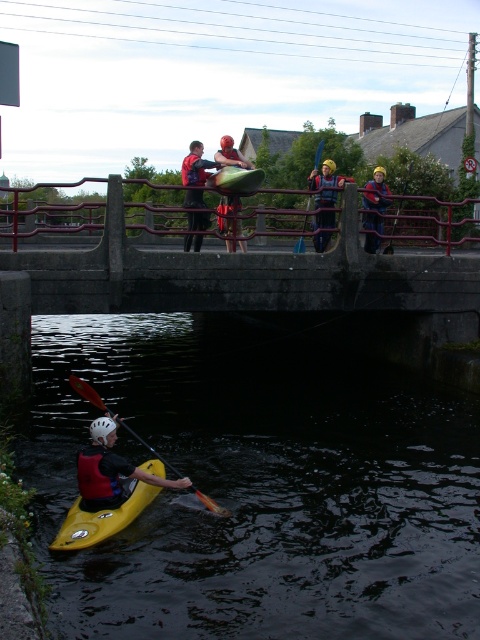
Is blue fabric life jacket at center shorter than matte green canoe at center?

No.

Is blue fabric life jacket at center to the right of matte green canoe at center from the viewer's perspective?

Yes, blue fabric life jacket at center is to the right of matte green canoe at center.

The width and height of the screenshot is (480, 640). What do you see at coordinates (324, 193) in the screenshot?
I see `blue fabric life jacket at center` at bounding box center [324, 193].

You are a GUI agent. You are given a task and a screenshot of the screen. Output one action in this format:
    pyautogui.click(x=<x>, y=<y>)
    Task: Click on the blue fabric life jacket at center
    Image resolution: width=480 pixels, height=640 pixels.
    Given the screenshot: What is the action you would take?
    pyautogui.click(x=324, y=193)

Is point (225, 163) positioned in front of point (321, 141)?

Yes, point (225, 163) is closer to viewer.

Which is in front, point (229, 227) or point (310, 202)?

Point (229, 227) is more forward.

I want to click on matte black kayak at upper center, so click(x=228, y=218).

Which is behind, point (323, 192) or point (228, 218)?

The point (323, 192) is more distant.

Is blue fabric life jacket at center shorter than red life jacket at center?

In fact, blue fabric life jacket at center may be taller than red life jacket at center.

Locate an element on the screen. This screenshot has height=640, width=480. blue fabric life jacket at center is located at coordinates tap(324, 193).